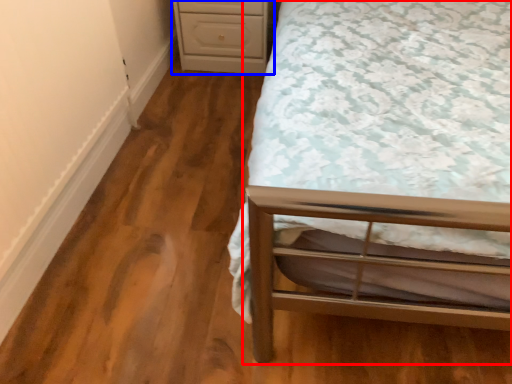
Question: Which object appears closest to the camera in this image, bed (highlighted by a red box) or chest of drawers (highlighted by a blue box)?

Choices:
 (A) bed
 (B) chest of drawers

Answer: (A)